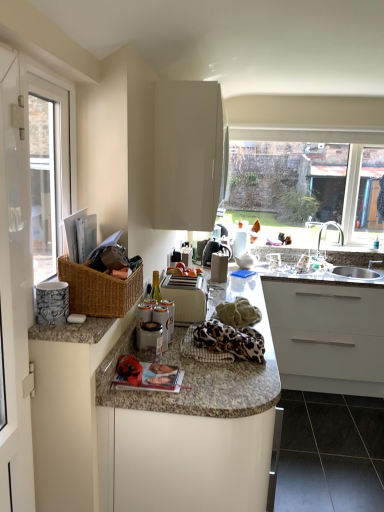
What do you see at coordinates (15, 292) in the screenshot? This screenshot has width=384, height=512. I see `white glossy screen door at left` at bounding box center [15, 292].

Measure the distance between point (193, 487) and camera.

The distance of point (193, 487) from camera is 4.72 feet.

Describe the element at coordinates (226, 335) in the screenshot. This screenshot has height=512, width=384. I see `leopard print fabric at center` at that location.

Image resolution: width=384 pixels, height=512 pixels. Describe the element at coordinates (354, 274) in the screenshot. I see `silver metallic sink at right` at that location.

Where is `silver metallic faucet at right`? silver metallic faucet at right is located at coordinates (326, 228).

Where is `black glossy tile at lower right`? The width and height of the screenshot is (384, 512). black glossy tile at lower right is located at coordinates (330, 453).

Based on their sizes in the image, would you say silver metallic sink at right is bigger or smaller than leopard print fabric at center?

silver metallic sink at right is bigger than leopard print fabric at center.

From a real-world perspective, is silver metallic sink at right physically below leopard print fabric at center?

Yes, from a real-world perspective, silver metallic sink at right is below leopard print fabric at center.

Would you say silver metallic sink at right is to the left or to the right of leopard print fabric at center in the picture?

silver metallic sink at right is to the right of leopard print fabric at center.

From the image's perspective, does silver metallic sink at right appear lower than leopard print fabric at center?

No, from the image's perspective, silver metallic sink at right is not beneath leopard print fabric at center.

Does white plastic toaster at center, the second appliance from the left, have a lesser width compared to white glossy cabinet at upper center, positioned as the second cabinetry in bottom-to-top order?

Yes.

From the picture: From the image's perspective, is white plastic toaster at center, marked as the 2th appliance in a front-to-back arrangement, over white glossy cabinet at upper center, positioned as the 1th cabinetry in top-to-bottom order?

No, from the image's perspective, white plastic toaster at center, marked as the 2th appliance in a front-to-back arrangement, is not above white glossy cabinet at upper center, positioned as the 1th cabinetry in top-to-bottom order.

Considering the sizes of objects white plastic toaster at center, the second appliance from the left, and white glossy cabinet at upper center, positioned as the 1th cabinetry in top-to-bottom order, in the image provided, who is bigger, white plastic toaster at center, the second appliance from the left, or white glossy cabinet at upper center, positioned as the 1th cabinetry in top-to-bottom order,?

With larger size is white glossy cabinet at upper center, positioned as the 1th cabinetry in top-to-bottom order.

Between point (174, 290) and point (192, 227), which one is positioned in front?

The point (174, 290) is in front.

In the image, is black glossy tile at lower right on the left side or the right side of leopard print fabric at center?

Clearly, black glossy tile at lower right is on the right of leopard print fabric at center in the image.

From the image's perspective, is black glossy tile at lower right above or below leopard print fabric at center?

Based on their image positions, black glossy tile at lower right is located beneath leopard print fabric at center.

Considering the sizes of objects black glossy tile at lower right and leopard print fabric at center in the image provided, who is wider, black glossy tile at lower right or leopard print fabric at center?

black glossy tile at lower right is wider.

Are black glossy tile at lower right and leopard print fabric at center located far from each other?

Indeed, black glossy tile at lower right is not near leopard print fabric at center.

Which of these two, silver metallic faucet at right or white glossy screen door at left, is smaller?

silver metallic faucet at right is smaller.

Which is closer, (342, 244) or (3, 169)?

Point (342, 244) is positioned farther from the camera compared to point (3, 169).

Are silver metallic faucet at right and white glossy screen door at left located far from each other?

Yes.

Is black glossy tile at lower right inside the boundaries of granite countertop at center, which ranks as the first cabinetry in bottom-to-top order, or outside?

black glossy tile at lower right is enclosed within granite countertop at center, which ranks as the first cabinetry in bottom-to-top order.

Would you say black glossy tile at lower right is to the left or to the right of granite countertop at center, arranged as the second cabinetry when viewed from the top, in the picture?

Based on their positions, black glossy tile at lower right is located to the right of granite countertop at center, arranged as the second cabinetry when viewed from the top.

From a real-world perspective, is black glossy tile at lower right on granite countertop at center, arranged as the second cabinetry when viewed from the top?

Actually, black glossy tile at lower right is physically below granite countertop at center, arranged as the second cabinetry when viewed from the top, in the real world.

Is black glossy tile at lower right thinner than granite countertop at center, arranged as the second cabinetry when viewed from the top?

Indeed, black glossy tile at lower right has a lesser width compared to granite countertop at center, arranged as the second cabinetry when viewed from the top.

Is porcelain blue and white mug at left, marked as the first appliance in a left-to-right arrangement, bigger or smaller than white glossy screen door at left?

Considering their sizes, porcelain blue and white mug at left, marked as the first appliance in a left-to-right arrangement, takes up less space than white glossy screen door at left.

Is porcelain blue and white mug at left, marked as the first appliance in a left-to-right arrangement, located outside white glossy screen door at left?

That's incorrect, porcelain blue and white mug at left, marked as the first appliance in a left-to-right arrangement, is not completely outside white glossy screen door at left.

Is porcelain blue and white mug at left, the first appliance viewed from the front, in front of or behind white glossy screen door at left in the image?

porcelain blue and white mug at left, the first appliance viewed from the front, is positioned farther from the viewer than white glossy screen door at left.

Is porcelain blue and white mug at left, the first appliance viewed from the front, turned away from white glossy screen door at left?

No.

Considering the positions of points (369, 271) and (350, 452), is point (369, 271) farther from camera compared to point (350, 452)?

That is True.

Does silver metallic sink at right have a greater height compared to black glossy tile at lower right?

Indeed, silver metallic sink at right has a greater height compared to black glossy tile at lower right.

Could black glossy tile at lower right be considered to be inside silver metallic sink at right?

That's incorrect, black glossy tile at lower right is not inside silver metallic sink at right.

Which object is further away from the camera taking this photo, silver metallic sink at right or black glossy tile at lower right?

silver metallic sink at right is more distant.

This screenshot has height=512, width=384. I want to click on material below the silver metallic sink at right (from the image's perspective), so click(226, 335).

Starting from the white plastic toaster at center, the second appliance from the left, which cabinetry is the 1st one to the right? Please provide its 2D coordinates.

[(189, 155)]

Estimate the real-world distances between objects in this image. Which object is further from silver metallic sink at right, leopard print fabric at center or white glossy cabinet at upper center, positioned as the 1th cabinetry in top-to-bottom order?

The object further to silver metallic sink at right is white glossy cabinet at upper center, positioned as the 1th cabinetry in top-to-bottom order.

Looking at the image, which one is located further to granite countertop at center, which ranks as the first cabinetry in bottom-to-top order, white glossy screen door at left or silver metallic sink at right?

silver metallic sink at right lies further to granite countertop at center, which ranks as the first cabinetry in bottom-to-top order, than the other object.

Looking at the image, which one is located further to porcelain blue and white mug at left, marked as the first appliance in a left-to-right arrangement, granite countertop at center, arranged as the second cabinetry when viewed from the top, or white glossy screen door at left?

Based on the image, granite countertop at center, arranged as the second cabinetry when viewed from the top, appears to be further to porcelain blue and white mug at left, marked as the first appliance in a left-to-right arrangement.

Looking at the image, which one is located further to silver metallic faucet at right, silver metallic sink at right or porcelain blue and white mug at left, marked as the first appliance in a left-to-right arrangement?

porcelain blue and white mug at left, marked as the first appliance in a left-to-right arrangement, is positioned further to the anchor silver metallic faucet at right.

From the image, which object appears to be farther from silver metallic faucet at right, white glossy screen door at left or white glossy cabinet at upper center, positioned as the second cabinetry in bottom-to-top order?

The object further to silver metallic faucet at right is white glossy screen door at left.

Estimate the real-world distances between objects in this image. Which object is closer to granite countertop at center, which ranks as the first cabinetry in bottom-to-top order, silver metallic sink at right or white plastic toaster at center, which is counted as the first appliance, starting from the back?

white plastic toaster at center, which is counted as the first appliance, starting from the back, is closer to granite countertop at center, which ranks as the first cabinetry in bottom-to-top order.

Considering their positions, is silver metallic faucet at right positioned closer to granite countertop at center, arranged as the second cabinetry when viewed from the top, than white glossy cabinet at upper center, positioned as the second cabinetry in bottom-to-top order?

white glossy cabinet at upper center, positioned as the second cabinetry in bottom-to-top order.

When comparing their distances from leopard print fabric at center, does porcelain blue and white mug at left, marked as the first appliance in a left-to-right arrangement, or white plastic toaster at center, marked as the 2th appliance in a front-to-back arrangement, seem further?

The object further to leopard print fabric at center is porcelain blue and white mug at left, marked as the first appliance in a left-to-right arrangement.

Find the location of a particular element. sink between black glossy tile at lower right and silver metallic faucet at right along the z-axis is located at coordinates (354, 274).

I want to click on material between granite countertop at center, arranged as the second cabinetry when viewed from the top, and silver metallic faucet at right, along the z-axis, so click(226, 335).

Where is `sink between porcelain blue and white mug at left, which is counted as the second appliance, starting from the back, and silver metallic faucet at right, along the z-axis`? sink between porcelain blue and white mug at left, which is counted as the second appliance, starting from the back, and silver metallic faucet at right, along the z-axis is located at coordinates (354, 274).

This screenshot has width=384, height=512. I want to click on tap between white plastic toaster at center, marked as the 2th appliance in a front-to-back arrangement, and silver metallic sink at right, in the horizontal direction, so click(326, 228).